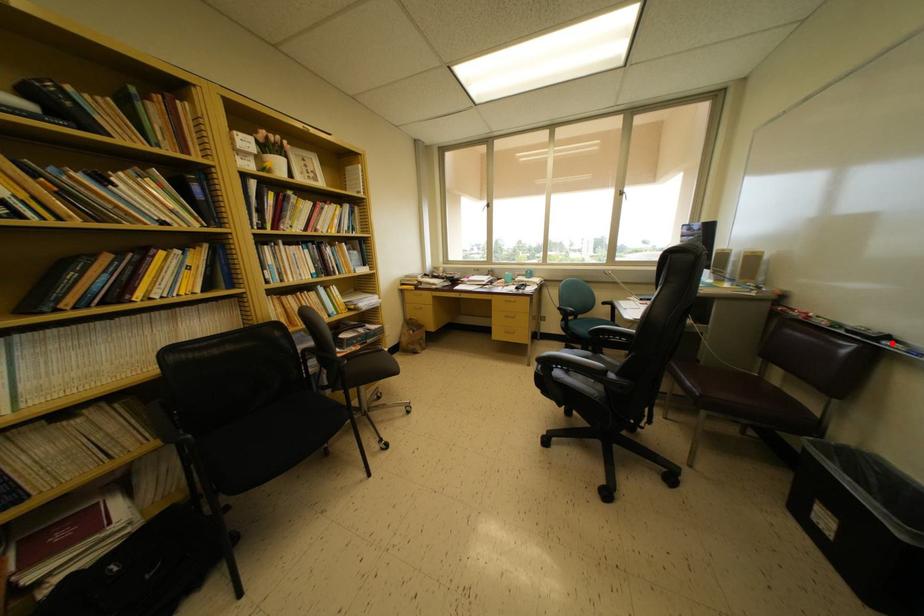
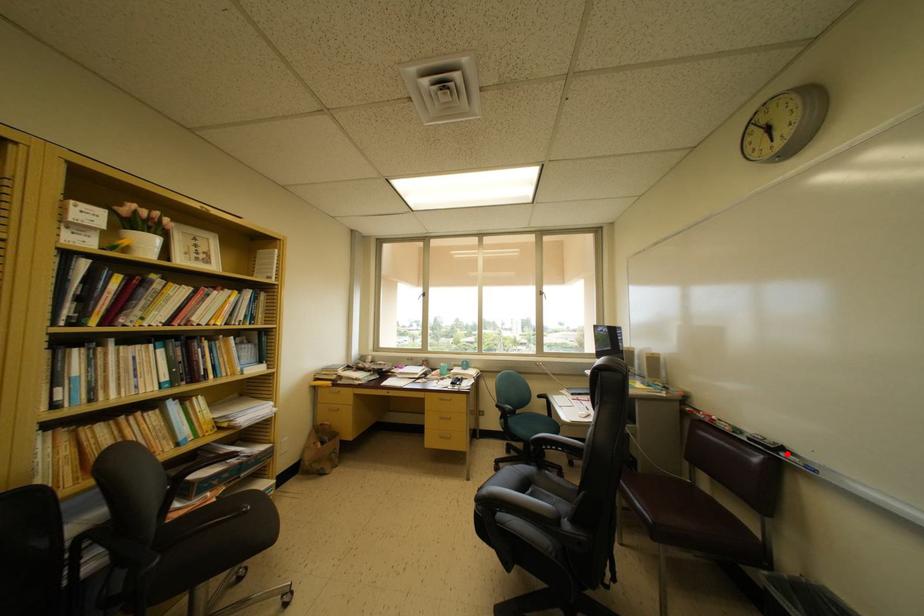
I am providing you with two images of the same scene from different viewpoints. A red point is marked on the first image and another point is marked on the second image. Does the point marked in image1 correspond to the same location as the one in image2?

Yes